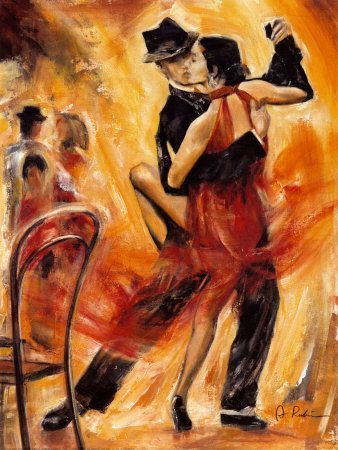
The image size is (338, 450). Find the location of `chair`. chair is located at coordinates 34,376.